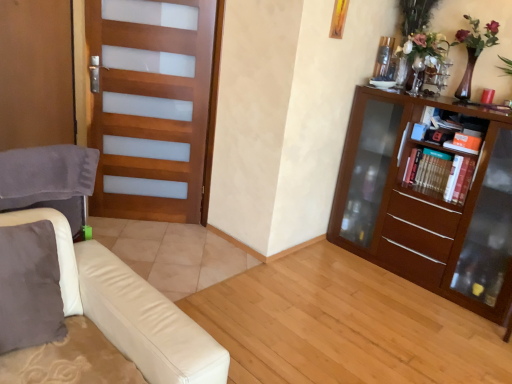
Locate an element on the screen. brown wooden bookcase at right is located at coordinates (429, 197).

This screenshot has height=384, width=512. Describe the element at coordinates (440, 173) in the screenshot. I see `wooden bookshelf at right` at that location.

What is the approximate height of hardcover books at right?

11.24 inches.

This screenshot has width=512, height=384. What do you see at coordinates (154, 107) in the screenshot? I see `wooden door at left` at bounding box center [154, 107].

I want to click on wooden door at left, so click(x=154, y=107).

Locate an element on the screen. This screenshot has height=384, width=512. velvet gray swivel chair at left is located at coordinates (48, 179).

Which point is more distant from viewer, (359, 202) or (70, 199)?

The point (359, 202) is farther from the camera.

Considering the relative positions of brown wooden bookcase at right and velvet gray swivel chair at left in the image provided, is brown wooden bookcase at right to the left or to the right of velvet gray swivel chair at left?

Based on their positions, brown wooden bookcase at right is located to the right of velvet gray swivel chair at left.

Considering the relative sizes of brown wooden bookcase at right and velvet gray swivel chair at left in the image provided, is brown wooden bookcase at right bigger than velvet gray swivel chair at left?

Indeed, brown wooden bookcase at right has a larger size compared to velvet gray swivel chair at left.

Is velvet gray swivel chair at left inside brown wooden bookcase at right?

No, velvet gray swivel chair at left is located outside of brown wooden bookcase at right.

Based on their positions, is wooden door at left located to the left or right of hardcover books at right?

Clearly, wooden door at left is on the left of hardcover books at right in the image.

Does wooden door at left have a greater width compared to hardcover books at right?

No.

Is point (122, 135) farther from viewer compared to point (461, 157)?

That is True.

Identify the location of book below the wooden door at left (from the image's perspective). (453, 178).

Identify the location of swivel chair in front of the hardcover books at right. This screenshot has width=512, height=384. (48, 179).

Is velvet gray swivel chair at left surrounded by hardcover books at right?

No, velvet gray swivel chair at left is located outside of hardcover books at right.

Can you confirm if hardcover books at right is wider than velvet gray swivel chair at left?

Yes, hardcover books at right is wider than velvet gray swivel chair at left.

Does hardcover books at right turn towards velvet gray swivel chair at left?

No, hardcover books at right is not turned towards velvet gray swivel chair at left.

From the image's perspective, is wooden screen door at left located above hardcover books at right?

Yes, from the image's perspective, wooden screen door at left is above hardcover books at right.

Is hardcover books at right inside wooden screen door at left?

Actually, hardcover books at right is outside wooden screen door at left.

Are wooden screen door at left and hardcover books at right making contact?

No, wooden screen door at left is not beside hardcover books at right.

Which point is more distant from viewer, (55, 42) or (446, 199)?

The point (55, 42) is farther from the camera.

In terms of width, does wooden bookshelf at right look wider or thinner when compared to hardcover books at right?

Considering their sizes, wooden bookshelf at right looks slimmer than hardcover books at right.

You are a GUI agent. You are given a task and a screenshot of the screen. Output one action in this format:
    pyautogui.click(x=<x>, y=<y>)
    Task: Click on the shelf on the left of the hardcover books at right
    This screenshot has width=512, height=384.
    Given the screenshot: What is the action you would take?
    pyautogui.click(x=440, y=173)

Is wooden bookshelf at right next to hardcover books at right?

Yes, wooden bookshelf at right is in contact with hardcover books at right.

Is wooden bookshelf at right facing towards hardcover books at right?

No, wooden bookshelf at right is not aimed at hardcover books at right.

From the picture: Is wooden door at left positioned with its back to velvet gray swivel chair at left?

No, wooden door at left's orientation is not away from velvet gray swivel chair at left.

Is the depth of wooden door at left less than that of velvet gray swivel chair at left?

That is False.

Is wooden door at left not inside velvet gray swivel chair at left?

That's correct, wooden door at left is outside of velvet gray swivel chair at left.

Does wooden door at left appear on the left side of velvet gray swivel chair at left?

No.

From a real-world perspective, is brown wooden bookcase at right physically located above or below wooden screen door at left?

Clearly, from a real-world perspective, brown wooden bookcase at right is below wooden screen door at left.

Is brown wooden bookcase at right bigger or smaller than wooden screen door at left?

Considering their sizes, brown wooden bookcase at right takes up more space than wooden screen door at left.

Does brown wooden bookcase at right have a greater height compared to wooden screen door at left?

No.

Can you tell me how much brown wooden bookcase at right and wooden screen door at left differ in facing direction?

The angular difference between brown wooden bookcase at right and wooden screen door at left is 90 degrees.

Where is `swivel chair above the brown wooden bookcase at right (from a real-world perspective)`? The height and width of the screenshot is (384, 512). swivel chair above the brown wooden bookcase at right (from a real-world perspective) is located at coordinates (48, 179).

You are a GUI agent. You are given a task and a screenshot of the screen. Output one action in this format:
    pyautogui.click(x=<x>, y=<y>)
    Task: Click on the door above the hardcover books at right (from the image's perspective)
    
    Given the screenshot: What is the action you would take?
    pyautogui.click(x=154, y=107)

From the picture: Estimate the real-world distances between objects in this image. Which object is closer to velvet gray swivel chair at left, wooden screen door at left or brown wooden bookcase at right?

brown wooden bookcase at right lies closer to velvet gray swivel chair at left than the other object.

Looking at the image, which one is located further to wooden screen door at left, velvet gray swivel chair at left or wooden door at left?

Based on the image, velvet gray swivel chair at left appears to be further to wooden screen door at left.

Looking at the image, which one is located closer to wooden bookshelf at right, hardcover books at right or wooden door at left?

Based on the image, hardcover books at right appears to be nearer to wooden bookshelf at right.

Considering their positions, is wooden bookshelf at right positioned closer to wooden screen door at left than hardcover books at right?

A: Among the two, wooden bookshelf at right is located nearer to wooden screen door at left.

Estimate the real-world distances between objects in this image. Which object is further from hardcover books at right, wooden screen door at left or wooden door at left?

wooden screen door at left.

Which object lies nearer to the anchor point brown wooden bookcase at right, wooden bookshelf at right or velvet gray swivel chair at left?

The object closer to brown wooden bookcase at right is wooden bookshelf at right.

Considering their positions, is hardcover books at right positioned closer to velvet gray swivel chair at left than wooden bookshelf at right?

The object closer to velvet gray swivel chair at left is wooden bookshelf at right.

When comparing their distances from velvet gray swivel chair at left, does wooden bookshelf at right or wooden door at left seem closer?

Based on the image, wooden door at left appears to be nearer to velvet gray swivel chair at left.

I want to click on bookcase situated between velvet gray swivel chair at left and hardcover books at right from left to right, so click(x=429, y=197).

The image size is (512, 384). Identify the location of swivel chair between wooden screen door at left and hardcover books at right in the horizontal direction. (48, 179).

Image resolution: width=512 pixels, height=384 pixels. Identify the location of shelf between wooden door at left and brown wooden bookcase at right in the horizontal direction. (440, 173).

Locate an element on the screen. This screenshot has width=512, height=384. door situated between wooden screen door at left and hardcover books at right from left to right is located at coordinates (154, 107).